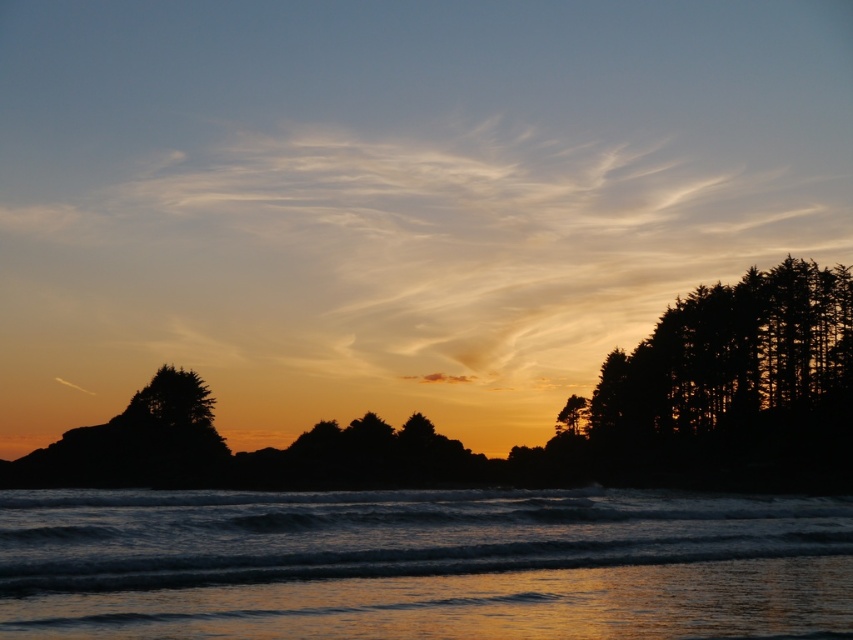
Question: Which point is closer to the camera?

Choices:
 (A) (822, 388)
 (B) (577, 429)
 (C) (368, 573)

Answer: (C)

Question: Which object appears farthest from the camera in this image?

Choices:
 (A) green matte tree at center-right
 (B) shiny golden water at lower center
 (C) silhouette trees at right

Answer: (A)

Question: From the image, what is the correct spatial relationship of shiny golden water at lower center in relation to green matte tree at center-right?

Choices:
 (A) left
 (B) right

Answer: (A)

Question: Does silhouette trees at right have a larger size compared to green matte tree at center-right?

Choices:
 (A) yes
 (B) no

Answer: (A)

Question: Observing the image, what is the correct spatial positioning of shiny golden water at lower center in reference to green matte tree at center-right?

Choices:
 (A) above
 (B) below

Answer: (A)

Question: Which point is farther from the camera taking this photo?

Choices:
 (A) (670, 323)
 (B) (584, 412)
 (C) (65, 490)

Answer: (B)